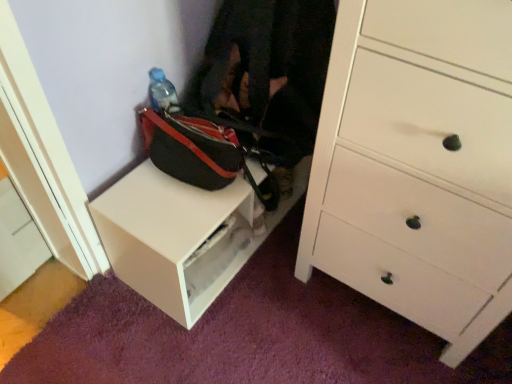
Where is `free space between white wood chest of drawers at center right and white matte table at lower left`? free space between white wood chest of drawers at center right and white matte table at lower left is located at coordinates (294, 315).